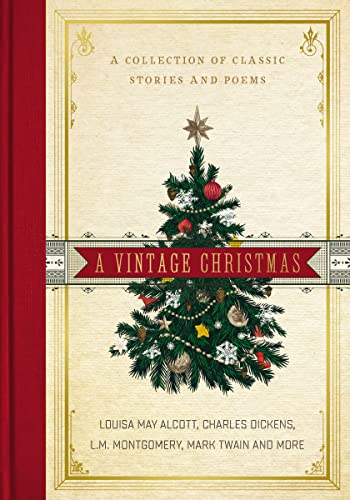
Locate an element on the screen. This screenshot has height=500, width=350. red christmas balls is located at coordinates click(x=214, y=190), click(x=185, y=224).